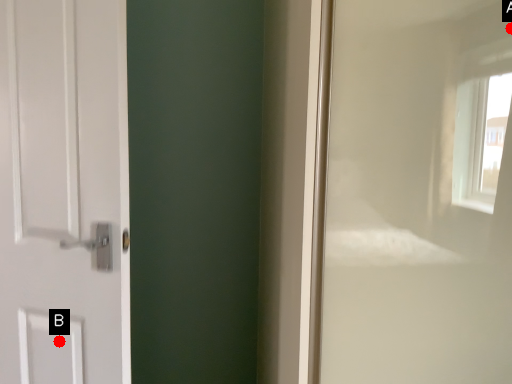
Question: Two points are circled on the image, labeled by A and B beside each circle. Which of the following is the closest to the observer?

Choices:
 (A) A is closer
 (B) B is closer

Answer: (A)